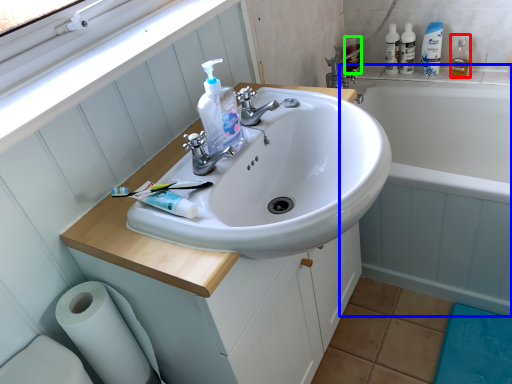
Question: Which object is the closest to the mouthwash (highlighted by a red box)? Choose among these: bath (highlighted by a blue box) or cleaning product (highlighted by a green box).

Choices:
 (A) bath
 (B) cleaning product

Answer: (B)